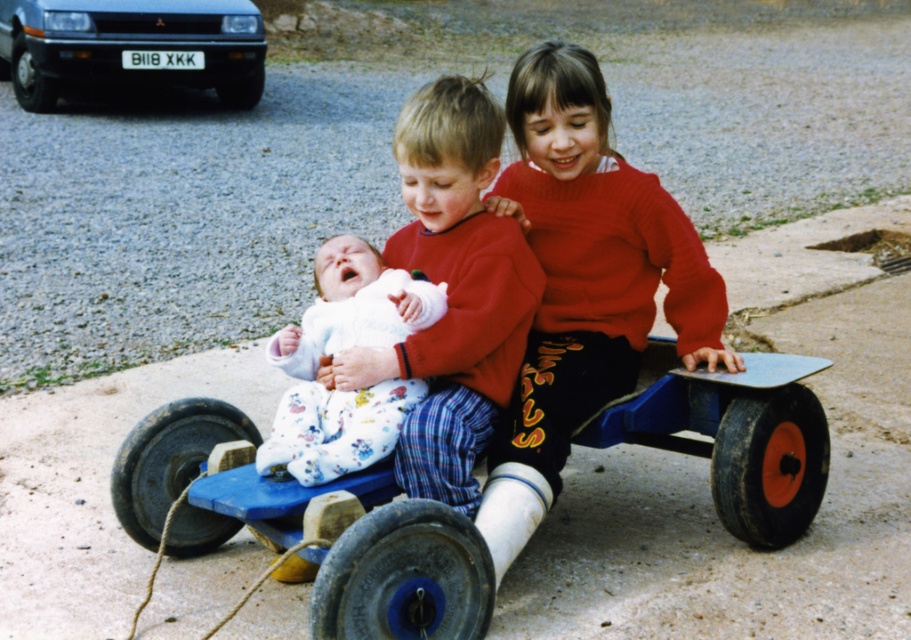
Question: Is blue plastic wagon at center to the left of white fleece baby at center from the viewer's perspective?

Choices:
 (A) no
 (B) yes

Answer: (B)

Question: Which point is closer to the camera?

Choices:
 (A) (486, 440)
 (B) (1, 8)
 (C) (658, 236)

Answer: (A)

Question: Does knitted red sweater at center have a lesser width compared to flannel pajama pants at center?

Choices:
 (A) no
 (B) yes

Answer: (A)

Question: Which point is closer to the camera?

Choices:
 (A) blue plastic wagon at center
 (B) white fleece baby at center

Answer: (A)

Question: Is white fleece baby at center closer to the viewer compared to silver metallic car at upper left?

Choices:
 (A) yes
 (B) no

Answer: (A)

Question: Which point is closer to the camera?

Choices:
 (A) (469, 147)
 (B) (580, 196)
 (C) (406, 301)
 (D) (718, 448)

Answer: (C)